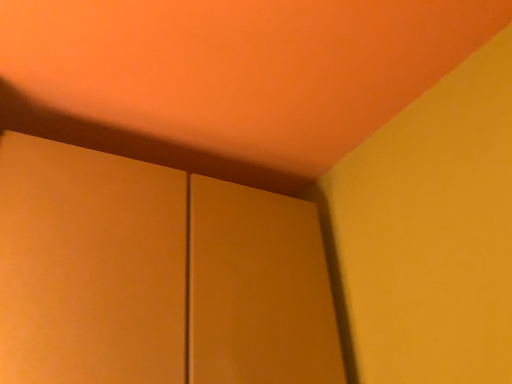
This screenshot has height=384, width=512. Identify the location of matte wood door at center. (155, 275).

This screenshot has height=384, width=512. What do you see at coordinates (155, 275) in the screenshot? I see `matte wood door at center` at bounding box center [155, 275].

Locate an element on the screen. matte wood door at center is located at coordinates (155, 275).